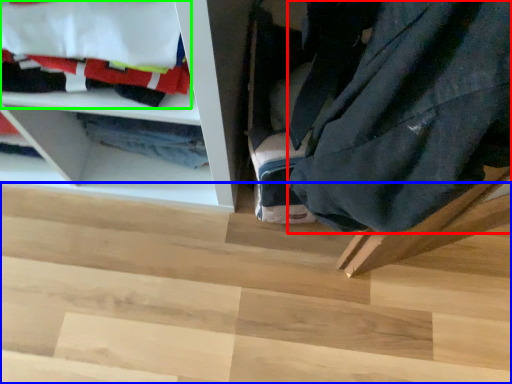
Question: Which is nearer to the clothing (highlighted by a red box)? stair (highlighted by a blue box) or laundry (highlighted by a green box).

Choices:
 (A) stair
 (B) laundry

Answer: (B)